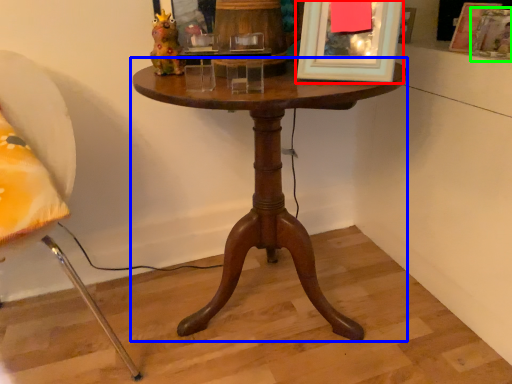
Question: Considering the real-world distances, which object is closest to picture frame (highlighted by a red box)? table (highlighted by a blue box) or picture frame (highlighted by a green box).

Choices:
 (A) table
 (B) picture frame

Answer: (A)